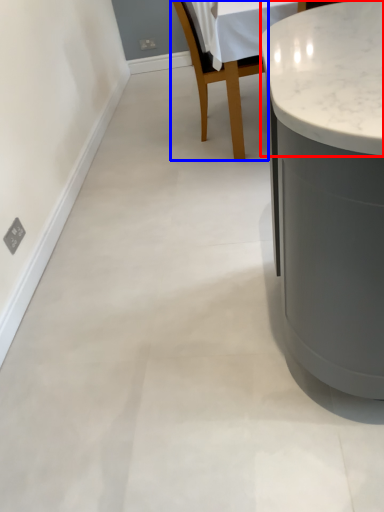
Question: Which object is closer to the camera taking this photo, counter top (highlighted by a red box) or chair (highlighted by a blue box)?

Choices:
 (A) counter top
 (B) chair

Answer: (A)